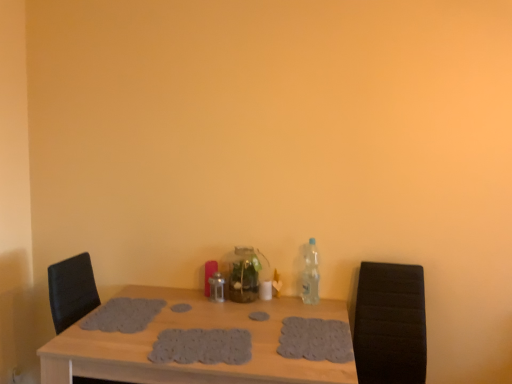
Question: Is clear plastic bottle at right, positioned as the second bottle in left-to-right order, smaller than black leather armchair at right?

Choices:
 (A) yes
 (B) no

Answer: (A)

Question: Is the depth of clear plastic bottle at right, positioned as the second bottle in left-to-right order, greater than that of black leather armchair at right?

Choices:
 (A) no
 (B) yes

Answer: (B)

Question: Does clear plastic bottle at right, the first bottle from the right, turn towards black leather armchair at right?

Choices:
 (A) yes
 (B) no

Answer: (B)

Question: From a real-world perspective, is clear plastic bottle at right, positioned as the second bottle in left-to-right order, positioned under black leather armchair at right based on gravity?

Choices:
 (A) no
 (B) yes

Answer: (A)

Question: Is clear plastic bottle at right, positioned as the second bottle in left-to-right order, shorter than black leather armchair at right?

Choices:
 (A) yes
 (B) no

Answer: (A)

Question: From the image's perspective, is gray fabric placemat at center, the 3th footprint in the left-to-right sequence, located beneath gray knitted placemat at center, the third footprint viewed from the right?

Choices:
 (A) yes
 (B) no

Answer: (B)

Question: Can you confirm if gray fabric placemat at center, which is the 2th footprint in right-to-left order, is taller than gray knitted placemat at center, the third footprint viewed from the right?

Choices:
 (A) yes
 (B) no

Answer: (A)

Question: Does gray fabric placemat at center, the 3th footprint in the left-to-right sequence, have a lesser height compared to gray knitted placemat at center, the third footprint viewed from the right?

Choices:
 (A) yes
 (B) no

Answer: (B)

Question: Is gray fabric placemat at center, which is the 2th footprint in right-to-left order, completely or partially outside of gray knitted placemat at center, the third footprint viewed from the right?

Choices:
 (A) yes
 (B) no

Answer: (A)

Question: Is gray fabric placemat at center, the 3th footprint in the left-to-right sequence, behind gray knitted placemat at center, positioned as the 2th footprint in left-to-right order?

Choices:
 (A) no
 (B) yes

Answer: (B)

Question: Can you confirm if gray fabric placemat at center, which is the 2th footprint in right-to-left order, is smaller than gray knitted placemat at center, positioned as the 2th footprint in left-to-right order?

Choices:
 (A) yes
 (B) no

Answer: (A)

Question: From the image's perspective, does black leather armchair at right appear higher than gray knitted placemat at center, the third footprint viewed from the right?

Choices:
 (A) yes
 (B) no

Answer: (B)